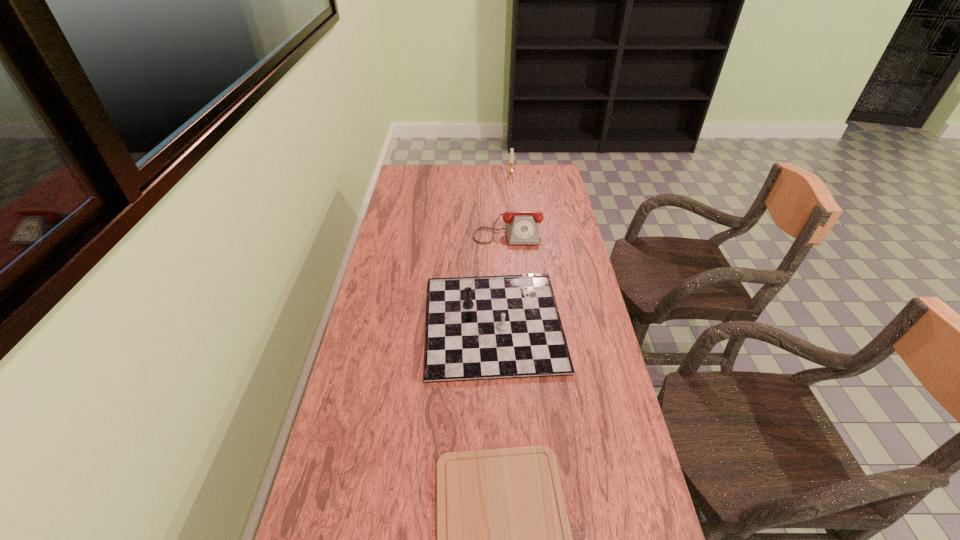
Find the location of a particular element. free space at the far edge is located at coordinates (488, 181).

Identify the location of free location at the left edge of the desktop. The image size is (960, 540). (378, 284).

This screenshot has width=960, height=540. In the image, there is a desktop. What are the coordinates of `vacant space at the right edge` in the screenshot? It's located at (595, 486).

The height and width of the screenshot is (540, 960). I want to click on vacant space at the far left corner of the desktop, so click(x=431, y=185).

The width and height of the screenshot is (960, 540). What are the coordinates of `vacant area at the far right corner of the desktop` in the screenshot? It's located at point(550,170).

Locate an element on the screen. The height and width of the screenshot is (540, 960). empty location between the second farthest object and the candle holder is located at coordinates tap(510, 200).

This screenshot has width=960, height=540. I want to click on vacant region between the farthest object and the telephone, so click(510, 200).

Locate an element on the screen. vacant area between the tallest object and the third farthest object is located at coordinates (502, 247).

You are a GUI agent. You are given a task and a screenshot of the screen. Output one action in this format:
    pyautogui.click(x=<x>, y=<y>)
    Task: Click on the free space between the candle holder and the third nearest object
    This screenshot has width=960, height=540.
    Given the screenshot: What is the action you would take?
    pyautogui.click(x=510, y=200)

Select which object is the third closest to the nearest object. Please provide its 2D coordinates. Your answer should be formatted as a tuple, i.e. [(x, y)], where the tuple contains the x and y coordinates of a point satisfying the conditions above.

[(511, 169)]